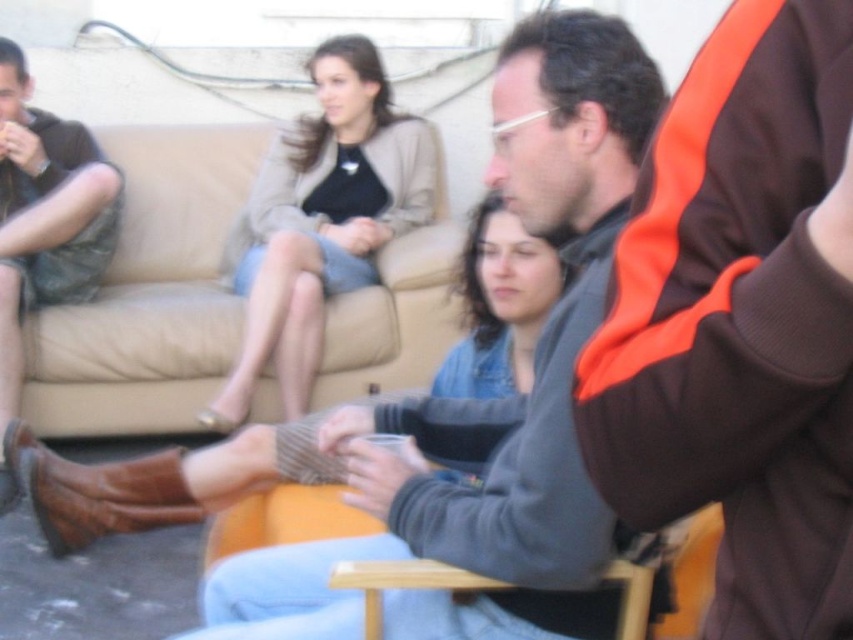
Question: Which object is farther from the camera taking this photo?

Choices:
 (A) light beige fabric skirt at upper center
 (B) leather boots at left
 (C) beige fabric couch at upper center

Answer: (C)

Question: Which of the following is the farthest from the observer?

Choices:
 (A) wooden chair at lower center
 (B) light beige fabric skirt at upper center
 (C) leather boots at left
 (D) brown fabric jacket at upper right

Answer: (B)

Question: Can you confirm if brown fabric jacket at upper right is thinner than leather boots at left?

Choices:
 (A) no
 (B) yes

Answer: (B)

Question: Which of these objects is positioned closest to the leather boots at left?

Choices:
 (A) wooden chair at lower center
 (B) light beige fabric skirt at upper center

Answer: (B)

Question: Is beige fabric couch at upper center positioned at the back of light beige fabric skirt at upper center?

Choices:
 (A) no
 (B) yes

Answer: (B)

Question: Is leather boots at left further to the viewer compared to wooden chair at lower center?

Choices:
 (A) yes
 (B) no

Answer: (A)